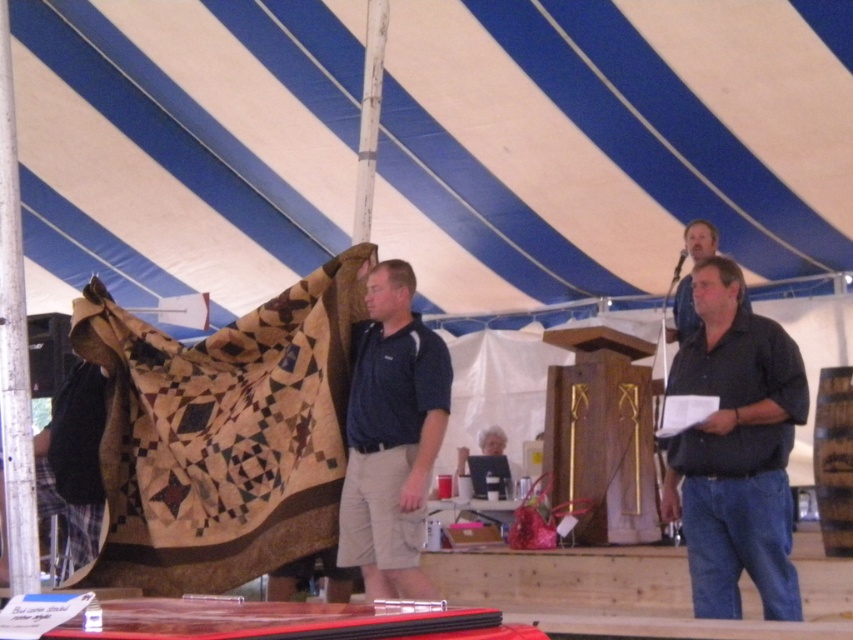
Question: Which object is the farthest from the dark blue shirt at center?

Choices:
 (A) dark blue cotton polo shirt at center
 (B) dark brown leather jacket at upper right

Answer: (B)

Question: Which is nearer to the blue and white striped canopy at upper center?

Choices:
 (A) quilted fabric at center
 (B) dark blue shirt at center

Answer: (A)

Question: Is the position of blue and white striped canopy at upper center more distant than that of dark brown leather jacket at upper right?

Choices:
 (A) yes
 (B) no

Answer: (A)

Question: Can you confirm if blue and white striped canopy at upper center is wider than dark blue shirt at center?

Choices:
 (A) no
 (B) yes

Answer: (B)

Question: Which object is the farthest from the dark blue cotton polo shirt at center?

Choices:
 (A) dark blue shirt at center
 (B) quilted fabric at center

Answer: (A)

Question: Considering the relative positions of blue and white striped canopy at upper center and dark blue shirt at center in the image provided, where is blue and white striped canopy at upper center located with respect to dark blue shirt at center?

Choices:
 (A) left
 (B) right

Answer: (A)